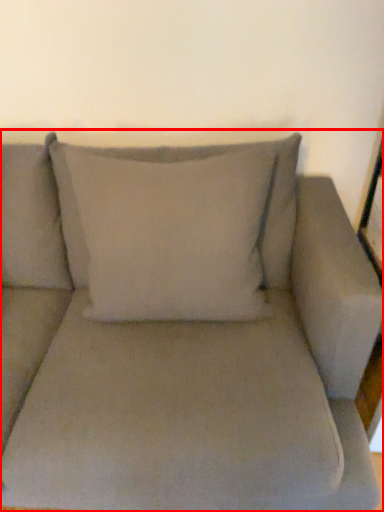
Question: From the image's perspective, what is the correct spatial relationship of studio couch (annotated by the red box) in relation to pillow?

Choices:
 (A) below
 (B) above

Answer: (A)